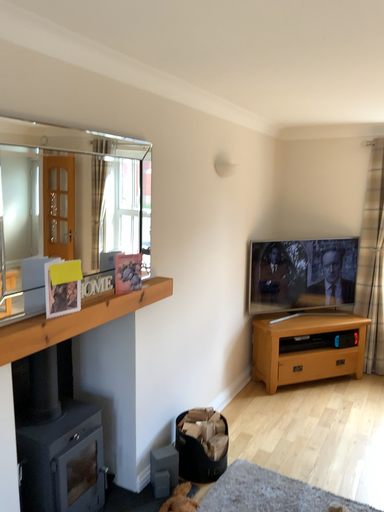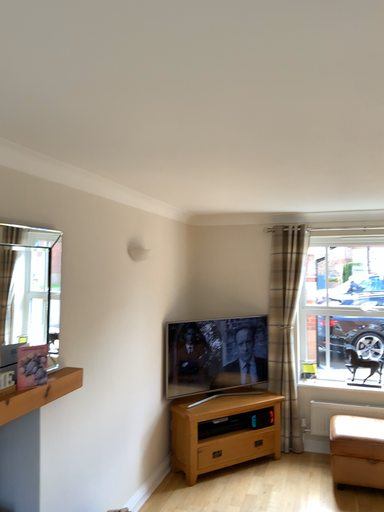
Question: How did the camera likely rotate when shooting the video?

Choices:
 (A) rotated right
 (B) rotated left

Answer: (A)